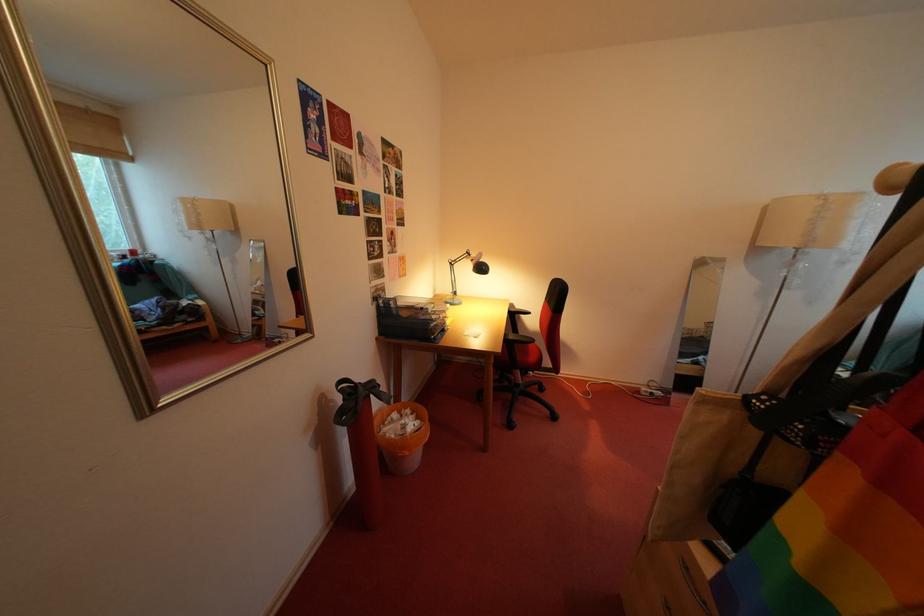
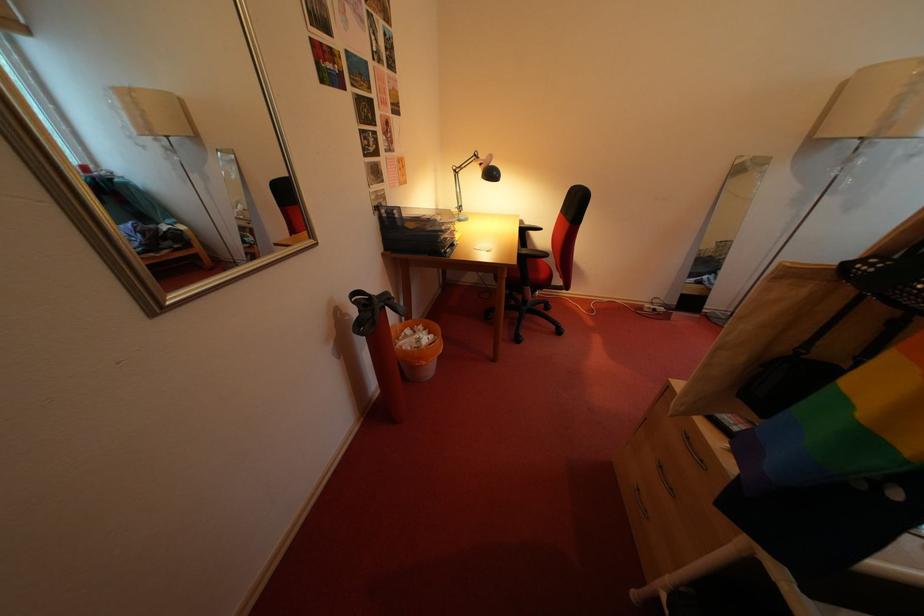
Locate, in the second image, the point that corresponds to (x=521, y=342) in the first image.

(535, 257)